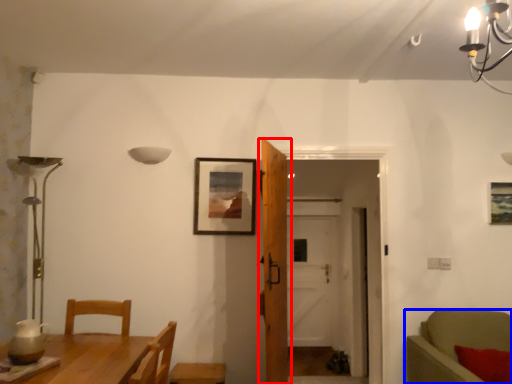
Question: Among these objects, which one is nearest to the camera, door (highlighted by a red box) or chair (highlighted by a blue box)?

Choices:
 (A) door
 (B) chair

Answer: (B)